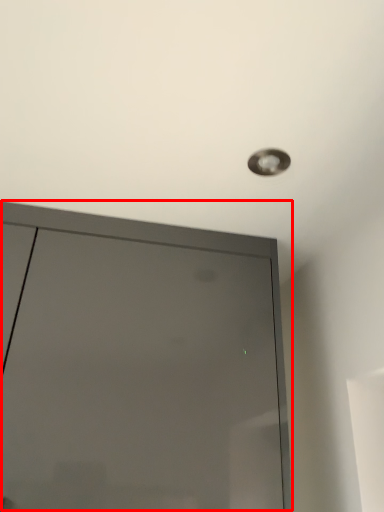
Question: From the image's perspective, what is the correct spatial relationship of door (annotated by the red box) in relation to droplight?

Choices:
 (A) above
 (B) below

Answer: (B)